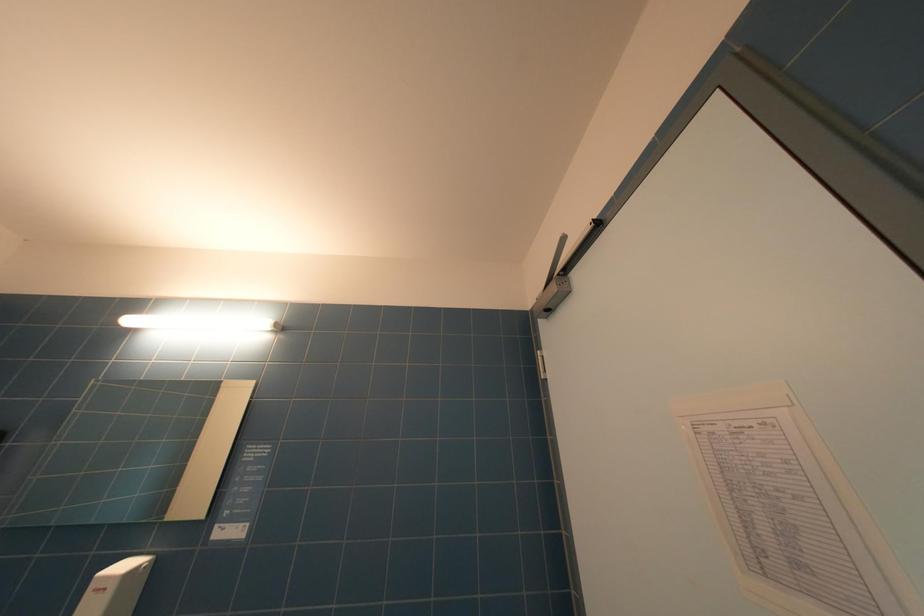
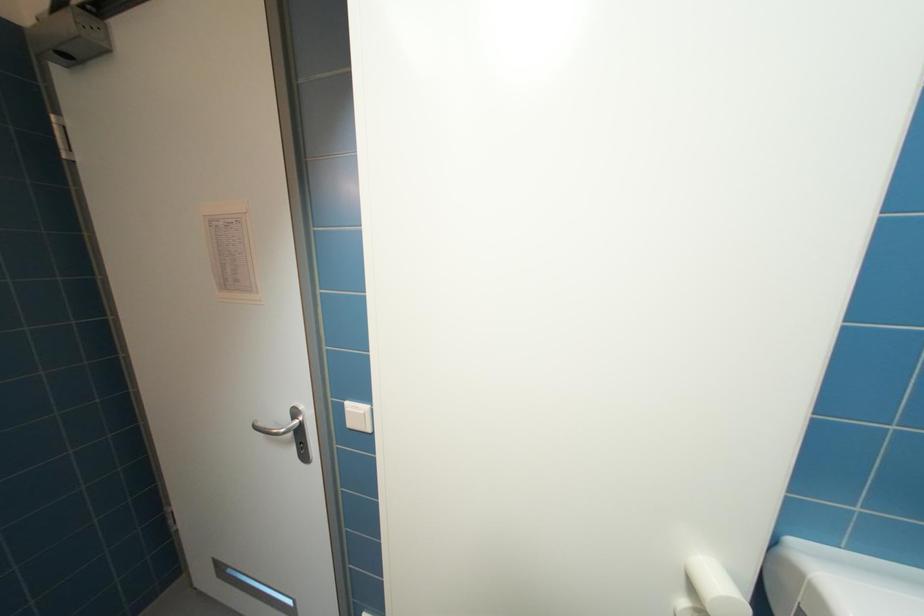
The first image is from the beginning of the video and the second image is from the end. How did the camera likely rotate when shooting the video?

The rotation direction of the camera is right-down.